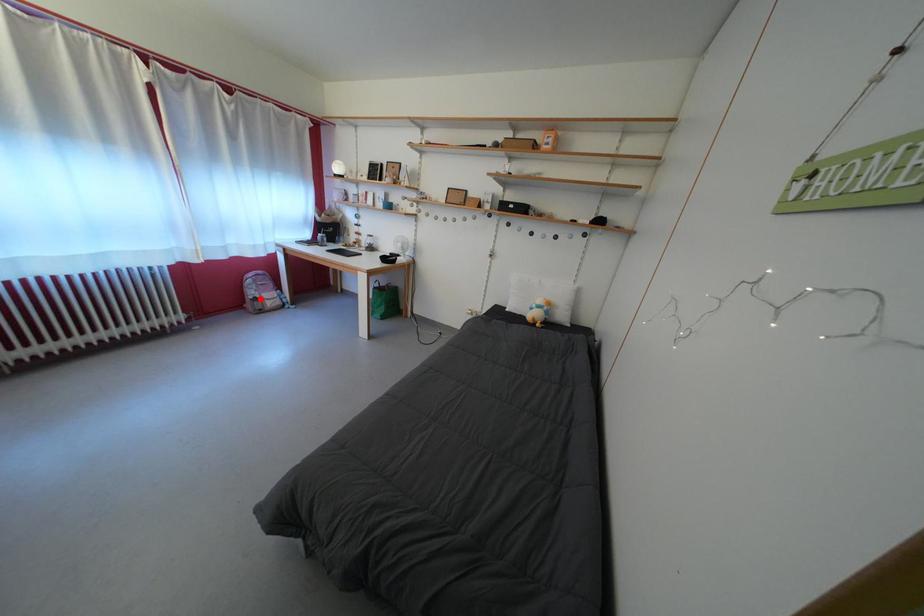
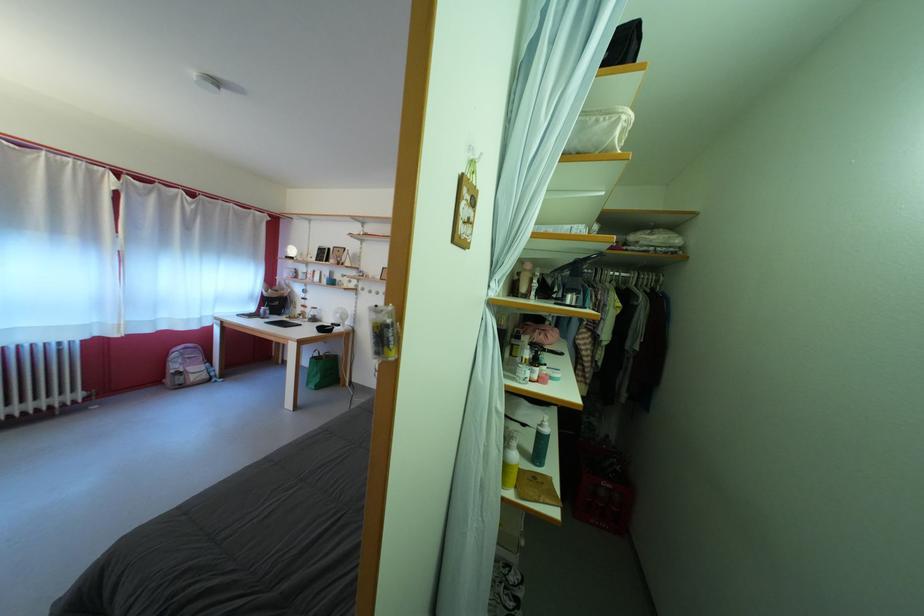
Question: I am providing you with two images of the same scene from different viewpoints. Given a red point in image1, look at the same physical point in image2. Is it:

Choices:
 (A) Closer to the viewpoint
 (B) Farther from the viewpoint

Answer: (B)